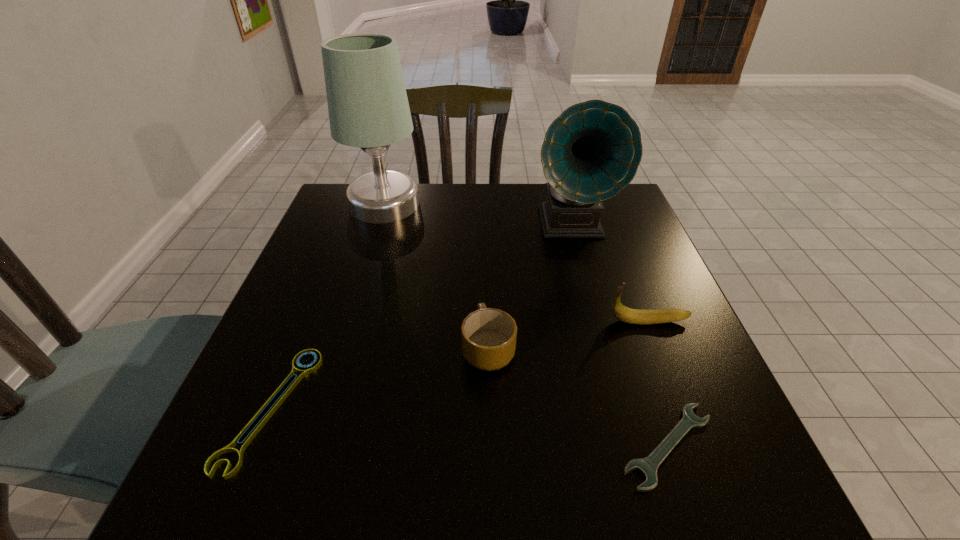
Where is `vacant region between the left wrench and the right wrench`? This screenshot has height=540, width=960. vacant region between the left wrench and the right wrench is located at coordinates (469, 427).

Where is `free space between the third object from left to right and the right wrench`? The width and height of the screenshot is (960, 540). free space between the third object from left to right and the right wrench is located at coordinates (578, 397).

Locate an element on the screen. This screenshot has width=960, height=540. empty space that is in between the fifth shortest object and the left wrench is located at coordinates (421, 316).

Identify the location of free space between the banana and the fourth object from right to left. (568, 335).

This screenshot has width=960, height=540. In order to click on free space between the right wrench and the banana in this screenshot , I will do `click(659, 383)`.

Identify which object is the second closest to the right wrench. Please provide its 2D coordinates. Your answer should be formatted as a tuple, i.e. [(x, y)], where the tuple contains the x and y coordinates of a point satisfying the conditions above.

[(633, 316)]

Identify which object is the fourth nearest to the second tallest object. Please provide its 2D coordinates. Your answer should be formatted as a tuple, i.e. [(x, y)], where the tuple contains the x and y coordinates of a point satisfying the conditions above.

[(648, 466)]

Identify the location of vacant region that satisfies the following two spatial constraints: 1. at the stem of the banana; 2. on the front side of the left wrench. The image size is (960, 540). (683, 408).

Where is `blank area in the image that satisfies the following two spatial constraints: 1. on the side with the handle of the fourth tallest object; 2. on the base of the tallest object`? This screenshot has width=960, height=540. blank area in the image that satisfies the following two spatial constraints: 1. on the side with the handle of the fourth tallest object; 2. on the base of the tallest object is located at coordinates (486, 204).

Where is `vacant point that satisfies the following two spatial constraints: 1. on the front side of the right wrench; 2. on the right side of the left wrench`? vacant point that satisfies the following two spatial constraints: 1. on the front side of the right wrench; 2. on the right side of the left wrench is located at coordinates (256, 446).